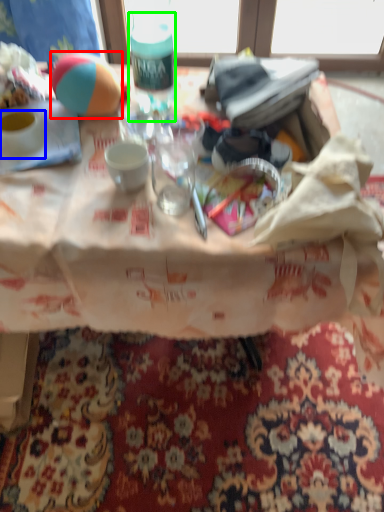
Question: Which object is positioned farthest from ball (highlighted by a red box)? Select from coffee cup (highlighted by a blue box) and bottle (highlighted by a green box).

Choices:
 (A) coffee cup
 (B) bottle

Answer: (A)